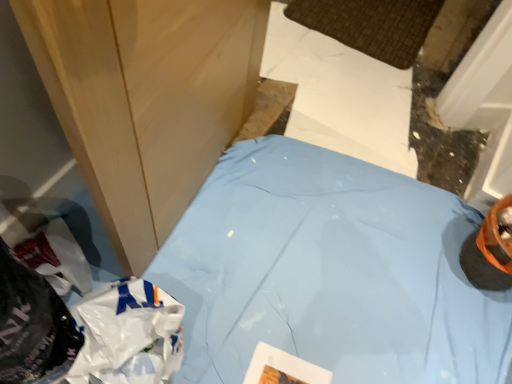
At what (x,y) coordinates should I click in order to perform the action: click on free point below blue fabric at center (from a real-world perspective). Please return your answer as a coordinate pair (x, y). This screenshot has width=512, height=384. Looking at the image, I should click on (326, 261).